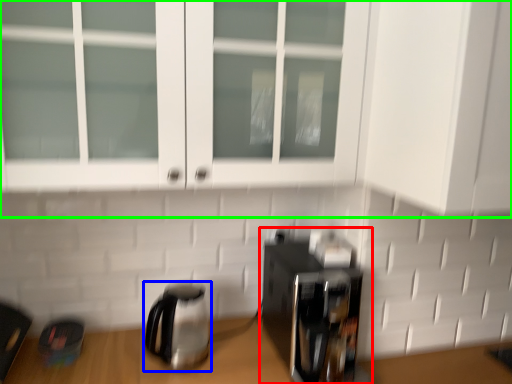
Question: Which object is positioned closest to coffee maker (highlighted by a red box)? Select from kettle (highlighted by a blue box) and cabinetry (highlighted by a green box).

Choices:
 (A) kettle
 (B) cabinetry

Answer: (A)